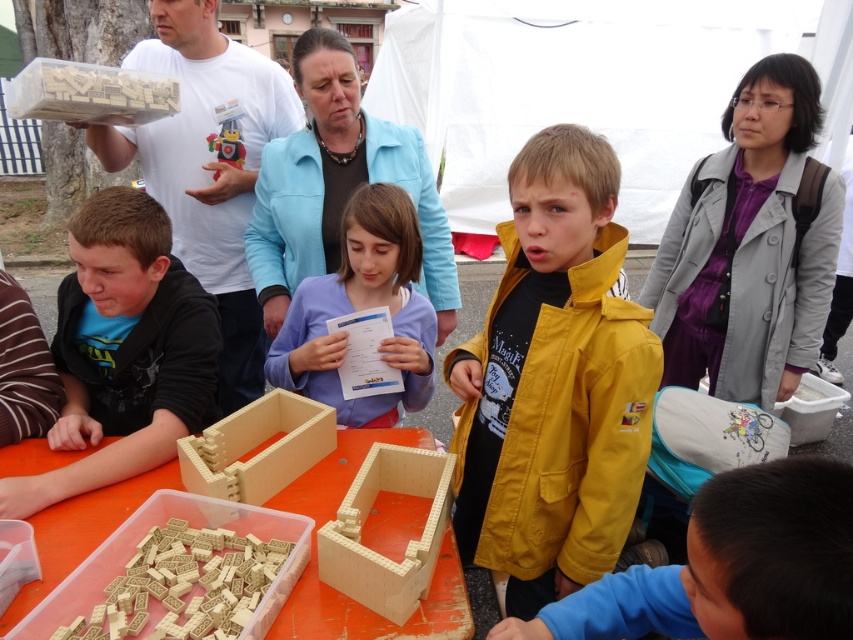
Is point (582, 609) behind point (292, 420)?

No, it is in front of (292, 420).

Who is taller, blue matte shirt at lower right or wooden box at center?

blue matte shirt at lower right

Describe the element at coordinates (730, 566) in the screenshot. I see `blue matte shirt at lower right` at that location.

Locate an element on the screen. The height and width of the screenshot is (640, 853). blue matte shirt at lower right is located at coordinates (730, 566).

Is point (488, 396) closer to camera compared to point (161, 310)?

Yes, it is.

Is yellow matte jacket at center taller than matte black hoodie at left?

Correct, yellow matte jacket at center is much taller as matte black hoodie at left.

Image resolution: width=853 pixels, height=640 pixels. What are the coordinates of `yellow matte jacket at center` in the screenshot? It's located at (554, 381).

Does blue matte shirt at lower right have a greater width compared to white matte t-shirt at upper left?

In fact, blue matte shirt at lower right might be narrower than white matte t-shirt at upper left.

Where is `blue matte shirt at lower right`? This screenshot has width=853, height=640. blue matte shirt at lower right is located at coordinates (730, 566).

What are the coordinates of `blue matte shirt at lower right` in the screenshot? It's located at (730, 566).

You are a GUI agent. You are given a task and a screenshot of the screen. Output one action in this format:
    pyautogui.click(x=<x>, y=<y>)
    Task: Click on the blue matte shirt at lower right
    The image size is (853, 640).
    Given the screenshot: What is the action you would take?
    pyautogui.click(x=730, y=566)